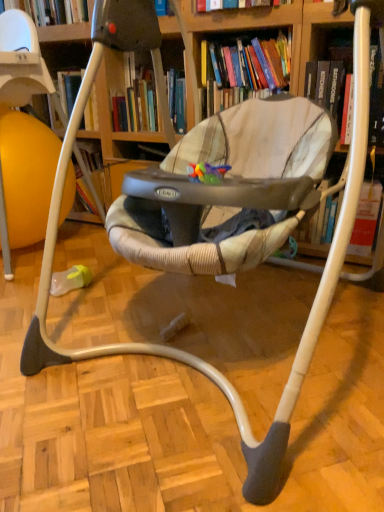
Looking at this image, what is the approximate width of hardcover book at upper center, the first book viewed from the left?

hardcover book at upper center, the first book viewed from the left, is 13.14 inches wide.

At what (x,y) coordinates should I click in order to perform the action: click on hardcover book at upper center, the first book viewed from the left. Please return your answer as a coordinate pair (x, y). The height and width of the screenshot is (512, 384). Looking at the image, I should click on (248, 64).

Locate an element on the screen. Image resolution: width=384 pixels, height=512 pixels. hardcover book at upper center, the first book viewed from the left is located at coordinates (248, 64).

Which object is wider, hardcover book at upper center, the first book viewed from the left, or hardcover book at upper right, which appears as the 2th book when viewed from the left?

hardcover book at upper right, which appears as the 2th book when viewed from the left, is wider.

Which object is further away from the camera, hardcover book at upper center, the first book viewed from the left, or hardcover book at upper right, which appears as the 2th book when viewed from the left?

hardcover book at upper center, the first book viewed from the left.

Is hardcover book at upper center, the second book in the right-to-left sequence, at the left side of hardcover book at upper right, which appears as the 2th book when viewed from the left?

Yes.

Considering the relative sizes of hardcover book at upper center, the second book in the right-to-left sequence, and hardcover book at upper right, placed as the first book when sorted from right to left, in the image provided, is hardcover book at upper center, the second book in the right-to-left sequence, smaller than hardcover book at upper right, placed as the first book when sorted from right to left,?

No.

From the image's perspective, which is below, hardcover book at upper center, the first book viewed from the left, or wooden bookcase at center?

wooden bookcase at center, from the image's perspective.

Is hardcover book at upper center, the first book viewed from the left, turned away from wooden bookcase at center?

No, hardcover book at upper center, the first book viewed from the left, is not facing away from wooden bookcase at center.

Between point (272, 72) and point (191, 68), which one is positioned behind?

The point (272, 72) is behind.

Choose the correct answer: Is hardcover book at upper center, the second book in the right-to-left sequence, inside wooden bookcase at center or outside it?

hardcover book at upper center, the second book in the right-to-left sequence, is not inside wooden bookcase at center, it's outside.

How distant is hardcover book at upper right, which appears as the 2th book when viewed from the left, from wooden bookcase at center?

A distance of 1.03 meters exists between hardcover book at upper right, which appears as the 2th book when viewed from the left, and wooden bookcase at center.

Can wooden bookcase at center be found inside hardcover book at upper right, which appears as the 2th book when viewed from the left?

Definitely not — wooden bookcase at center is not inside hardcover book at upper right, which appears as the 2th book when viewed from the left.

Considering the sizes of hardcover book at upper right, placed as the first book when sorted from right to left, and wooden bookcase at center in the image, is hardcover book at upper right, placed as the first book when sorted from right to left, wider or thinner than wooden bookcase at center?

hardcover book at upper right, placed as the first book when sorted from right to left, is thinner than wooden bookcase at center.

Is hardcover book at upper right, which appears as the 2th book when viewed from the left, positioned in front of wooden bookcase at center?

No, hardcover book at upper right, which appears as the 2th book when viewed from the left, is behind wooden bookcase at center.

Is hardcover book at upper right, placed as the first book when sorted from right to left, wider than hardcover book at upper center, the second book in the right-to-left sequence?

Correct, the width of hardcover book at upper right, placed as the first book when sorted from right to left, exceeds that of hardcover book at upper center, the second book in the right-to-left sequence.

Looking at this image, is hardcover book at upper right, which appears as the 2th book when viewed from the left, oriented towards hardcover book at upper center, the first book viewed from the left?

No, hardcover book at upper right, which appears as the 2th book when viewed from the left, is not facing towards hardcover book at upper center, the first book viewed from the left.

From the image's perspective, is hardcover book at upper right, placed as the first book when sorted from right to left, located above hardcover book at upper center, the second book in the right-to-left sequence?

No, from the image's perspective, hardcover book at upper right, placed as the first book when sorted from right to left, is not above hardcover book at upper center, the second book in the right-to-left sequence.

In terms of size, does hardcover book at upper right, which appears as the 2th book when viewed from the left, appear bigger or smaller than hardcover book at upper center, the first book viewed from the left?

hardcover book at upper right, which appears as the 2th book when viewed from the left, is smaller than hardcover book at upper center, the first book viewed from the left.

Is wooden bookcase at center not within hardcover book at upper right, which appears as the 2th book when viewed from the left?

wooden bookcase at center is positioned outside hardcover book at upper right, which appears as the 2th book when viewed from the left.

Which of these two, wooden bookcase at center or hardcover book at upper right, placed as the first book when sorted from right to left, is bigger?

Bigger between the two is wooden bookcase at center.

Which point is more distant from viewer, (x=42, y=65) or (x=350, y=36)?

Positioned behind is point (x=42, y=65).

Is wooden bookcase at center looking in the opposite direction of hardcover book at upper center, the second book in the right-to-left sequence?

Correct, wooden bookcase at center is looking away from hardcover book at upper center, the second book in the right-to-left sequence.

The height and width of the screenshot is (512, 384). I want to click on bookcase below the hardcover book at upper center, the first book viewed from the left (from the image's perspective), so click(23, 49).

How much distance is there between wooden bookcase at center and hardcover book at upper center, the first book viewed from the left?

They are 30.09 inches apart.

Can you tell me how much wooden bookcase at center and hardcover book at upper center, the first book viewed from the left, differ in facing direction?

The angle between the facing direction of wooden bookcase at center and the facing direction of hardcover book at upper center, the first book viewed from the left, is 8.37 degrees.

This screenshot has height=512, width=384. I want to click on book above the hardcover book at upper right, which appears as the 2th book when viewed from the left (from the image's perspective), so click(248, 64).

Starting from the wooden bookcase at center, which book is the 2nd one behind? Please provide its 2D coordinates.

[(248, 64)]

Looking at the image, which one is located further to hardcover book at upper center, the second book in the right-to-left sequence, wooden bookcase at center or hardcover book at upper right, which appears as the 2th book when viewed from the left?

wooden bookcase at center lies further to hardcover book at upper center, the second book in the right-to-left sequence, than the other object.

When comparing their distances from wooden bookcase at center, does hardcover book at upper center, the first book viewed from the left, or hardcover book at upper right, placed as the first book when sorted from right to left, seem further?

Among the two, hardcover book at upper right, placed as the first book when sorted from right to left, is located further to wooden bookcase at center.

When comparing their distances from hardcover book at upper center, the first book viewed from the left, does hardcover book at upper right, which appears as the 2th book when viewed from the left, or wooden bookcase at center seem further?

wooden bookcase at center is further to hardcover book at upper center, the first book viewed from the left.

Considering their positions, is hardcover book at upper right, placed as the first book when sorted from right to left, positioned further to wooden bookcase at center than hardcover book at upper center, the second book in the right-to-left sequence?

Based on the image, hardcover book at upper right, placed as the first book when sorted from right to left, appears to be further to wooden bookcase at center.

From the image, which object appears to be farther from hardcover book at upper right, placed as the first book when sorted from right to left, hardcover book at upper center, the first book viewed from the left, or wooden bookcase at center?

Among the two, wooden bookcase at center is located further to hardcover book at upper right, placed as the first book when sorted from right to left.

Based on the photo, from the image, which object appears to be farther from hardcover book at upper right, placed as the first book when sorted from right to left, wooden bookcase at center or hardcover book at upper center, the second book in the right-to-left sequence?

wooden bookcase at center lies further to hardcover book at upper right, placed as the first book when sorted from right to left, than the other object.

This screenshot has height=512, width=384. In order to click on book between wooden bookcase at center and hardcover book at upper center, the second book in the right-to-left sequence, in the front-back direction in this screenshot , I will do `click(326, 46)`.